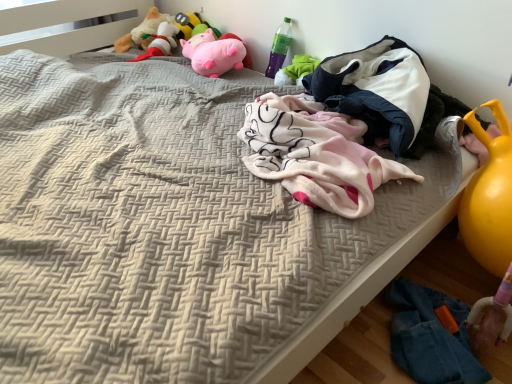
Question: Considering the relative sizes of fluffy beige stuffed animal at upper left, placed as the 1th toy when sorted from left to right, and pink plush toy at upper center, the second toy from the right, in the image provided, is fluffy beige stuffed animal at upper left, placed as the 1th toy when sorted from left to right, wider than pink plush toy at upper center, the second toy from the right,?

Choices:
 (A) no
 (B) yes

Answer: (B)

Question: Can you confirm if fluffy beige stuffed animal at upper left, placed as the 1th toy when sorted from left to right, is shorter than pink plush toy at upper center, the third toy from the left?

Choices:
 (A) no
 (B) yes

Answer: (A)

Question: Is fluffy beige stuffed animal at upper left, placed as the 1th toy when sorted from left to right, at the left side of pink plush toy at upper center, the third toy from the left?

Choices:
 (A) yes
 (B) no

Answer: (A)

Question: Is the surface of fluffy beige stuffed animal at upper left, which is counted as the fourth toy, starting from the right, in direct contact with pink plush toy at upper center, the second toy from the right?

Choices:
 (A) yes
 (B) no

Answer: (B)

Question: From a real-world perspective, is fluffy beige stuffed animal at upper left, which is counted as the fourth toy, starting from the right, beneath pink plush toy at upper center, the second toy from the right?

Choices:
 (A) no
 (B) yes

Answer: (A)

Question: Visually, is denim jeans at lower right positioned to the left or to the right of fluffy plush toy at upper left, marked as the 2th toy in a left-to-right arrangement?

Choices:
 (A) left
 (B) right

Answer: (B)

Question: Considering the positions of denim jeans at lower right and fluffy plush toy at upper left, positioned as the 3th toy in right-to-left order, in the image, is denim jeans at lower right wider or thinner than fluffy plush toy at upper left, positioned as the 3th toy in right-to-left order,?

Choices:
 (A) thin
 (B) wide

Answer: (A)

Question: From a real-world perspective, relative to fluffy plush toy at upper left, positioned as the 3th toy in right-to-left order, is denim jeans at lower right vertically above or below?

Choices:
 (A) above
 (B) below

Answer: (B)

Question: Considering the positions of denim jeans at lower right and fluffy plush toy at upper left, positioned as the 3th toy in right-to-left order, in the image, is denim jeans at lower right bigger or smaller than fluffy plush toy at upper left, positioned as the 3th toy in right-to-left order,?

Choices:
 (A) big
 (B) small

Answer: (A)

Question: In terms of width, does fluffy plush toy at upper left, positioned as the 3th toy in right-to-left order, look wider or thinner when compared to green plastic bottle at upper right?

Choices:
 (A) thin
 (B) wide

Answer: (B)

Question: Would you say fluffy plush toy at upper left, positioned as the 3th toy in right-to-left order, is to the left or to the right of green plastic bottle at upper right in the picture?

Choices:
 (A) right
 (B) left

Answer: (B)

Question: From the image's perspective, is fluffy plush toy at upper left, positioned as the 3th toy in right-to-left order, above or below green plastic bottle at upper right?

Choices:
 (A) below
 (B) above

Answer: (B)

Question: Is point (154, 21) closer or farther from the camera than point (273, 54)?

Choices:
 (A) closer
 (B) farther

Answer: (B)

Question: From a real-world perspective, is green plastic bottle at upper right physically located above or below pink plush pig at upper center, the first toy in the right-to-left sequence?

Choices:
 (A) below
 (B) above

Answer: (B)

Question: Is green plastic bottle at upper right spatially inside pink plush pig at upper center, which is counted as the 4th toy, starting from the left, or outside of it?

Choices:
 (A) inside
 (B) outside

Answer: (B)